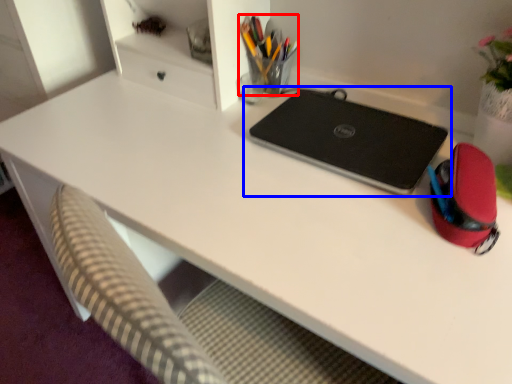
Question: Which object appears farthest to the camera in this image, stationery (highlighted by a red box) or laptop (highlighted by a blue box)?

Choices:
 (A) stationery
 (B) laptop

Answer: (A)